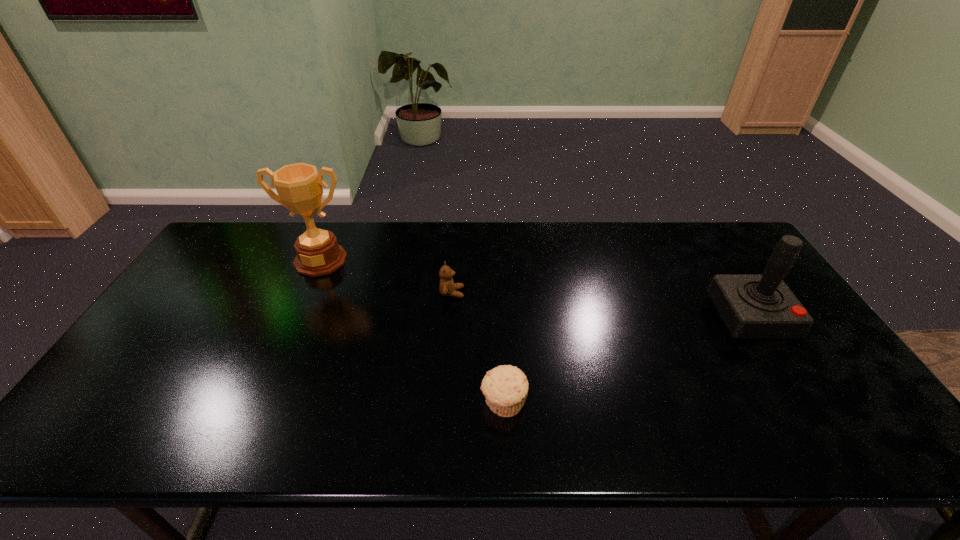
Where is `award`? The width and height of the screenshot is (960, 540). award is located at coordinates (299, 186).

Where is `the leftmost object`? This screenshot has width=960, height=540. the leftmost object is located at coordinates (299, 186).

Where is `joystick`? The width and height of the screenshot is (960, 540). joystick is located at coordinates (752, 306).

Image resolution: width=960 pixels, height=540 pixels. I want to click on the third shortest object, so click(x=752, y=306).

Identify the location of the second object from left to right. (447, 287).

At what (x,y) coordinates should I click in order to perform the action: click on muffin. Please return your answer as a coordinate pair (x, y). The image size is (960, 540). Looking at the image, I should click on (505, 387).

The height and width of the screenshot is (540, 960). In order to click on the third object from left to right in this screenshot , I will do `click(505, 387)`.

Find the location of a particular element. The image size is (960, 540). free space located on the front-facing side of the award is located at coordinates (303, 299).

Identify the location of free spot located on the base of the joystick. The image size is (960, 540). (830, 443).

What are the coordinates of `vacant region located 0.070m on the front-facing side of the third object from right to left` in the screenshot? It's located at (487, 293).